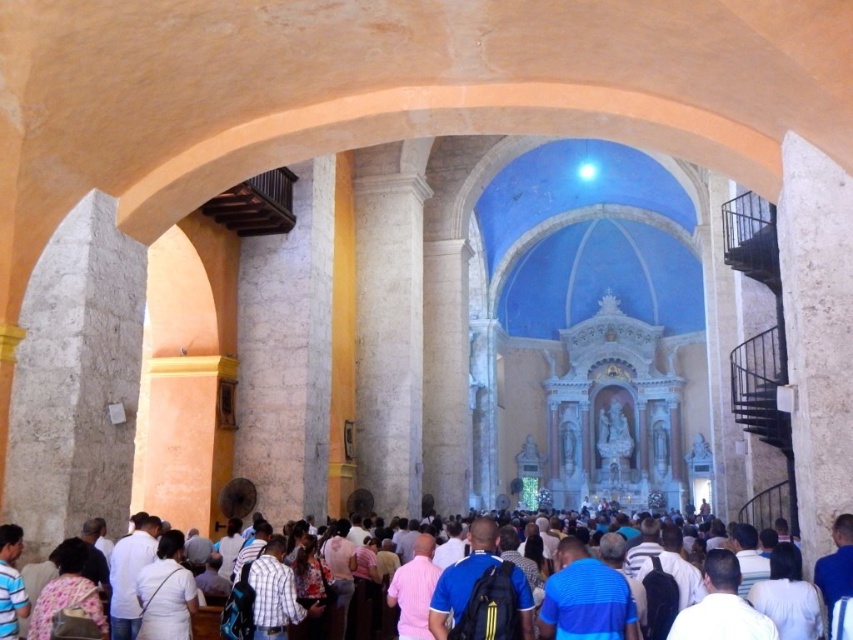
Who is more distant from viewer, (x=821, y=566) or (x=171, y=630)?

The point (x=171, y=630) is behind.

Can you confirm if white cotton shirt at center is positioned to the left of white fabric shirt at lower left?

No, white cotton shirt at center is not to the left of white fabric shirt at lower left.

Is point (357, 636) closer to camera compared to point (141, 596)?

That is False.

Identify the location of white cotton shirt at center. This screenshot has height=640, width=853. (833, 579).

At what (x,y) coordinates should I click in order to perform the action: click on white fabric shirt at lower left. Please return your answer as a coordinate pair (x, y). The height and width of the screenshot is (640, 853). Looking at the image, I should click on click(x=166, y=593).

Who is taller, white fabric shirt at lower left or light brown leather backpack at lower left?

light brown leather backpack at lower left

Which is in front, point (186, 588) or point (45, 632)?

Point (45, 632) is more forward.

Locate an element on the screen. The height and width of the screenshot is (640, 853). white fabric shirt at lower left is located at coordinates (166, 593).

In the scene shown: How far apart are white cotton shirt at center and light brown leather backpack at lower left?

white cotton shirt at center is 6.23 meters from light brown leather backpack at lower left.

Which of these two, white cotton shirt at center or light brown leather backpack at lower left, stands shorter?

light brown leather backpack at lower left

Identify the location of white cotton shirt at center. This screenshot has width=853, height=640. (833, 579).